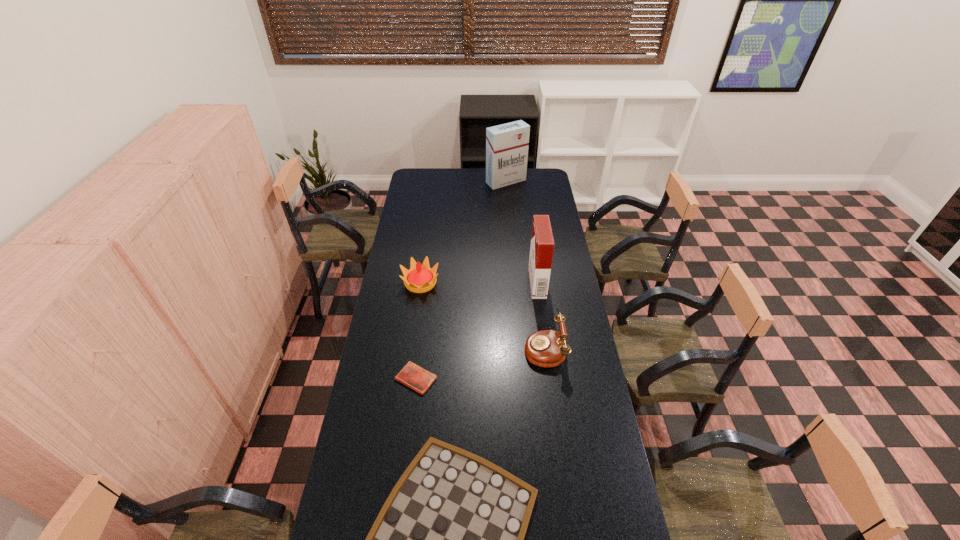
Find the location of a particular element. Image resolution: width=960 pixels, height=540 pixels. the farthest object is located at coordinates (507, 144).

The image size is (960, 540). I want to click on the nearer cigarette_case, so click(542, 243).

Where is `telephone`? telephone is located at coordinates (547, 348).

This screenshot has width=960, height=540. Find the location of `crown`. crown is located at coordinates (419, 278).

Where is `diary`? The height and width of the screenshot is (540, 960). diary is located at coordinates (415, 377).

In order to click on vacant space located 0.240m on the left of the farther cigarette_case in this screenshot , I will do `click(446, 181)`.

Find the location of a particular element. The height and width of the screenshot is (540, 960). free location located 0.050m on the front-facing side of the nearer cigarette_case is located at coordinates (519, 283).

This screenshot has height=540, width=960. Identify the location of free space located 0.090m on the front-facing side of the nearer cigarette_case. (511, 283).

The image size is (960, 540). I want to click on vacant area situated 0.200m on the front-facing side of the nearer cigarette_case, so click(x=488, y=283).

The height and width of the screenshot is (540, 960). Find the location of `free space located 0.060m on the dial of the telephone`. free space located 0.060m on the dial of the telephone is located at coordinates (509, 348).